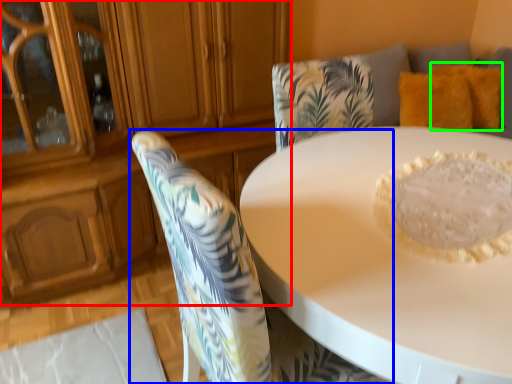
Question: Considering the real-world distances, which object is closest to dresser (highlighted by a red box)? chair (highlighted by a blue box) or pillow (highlighted by a green box).

Choices:
 (A) chair
 (B) pillow

Answer: (A)